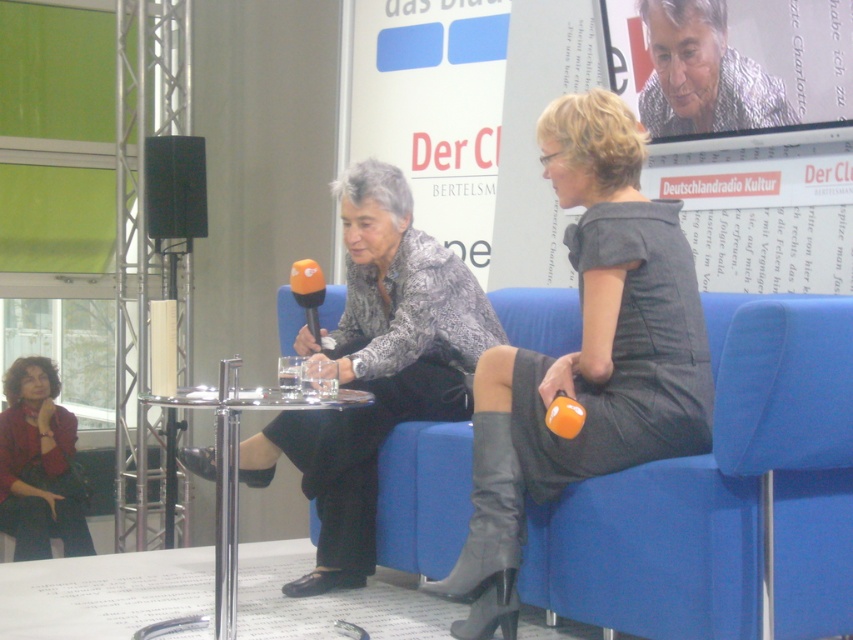
You are organizing a charity event and need to decide which of the two jackets to use as a prop. The textured gray sweater at center and the matte red jacket at lower left are available. Based on their sizes, which one would be more suitable for a prop that requires a larger size?

The matte red jacket at lower left is larger than the textured gray sweater at center, so it would be more suitable for a prop requiring a larger size.

You are organizing a photo shoot and need to position a spotlight above the textured gray sweater at center. Can you place it there without it overlapping the matte red jacket at lower left?

The textured gray sweater at center is located above the matte red jacket at lower left, so placing a spotlight above the textured gray sweater at center would not overlap the matte red jacket at lower left.

You are a photographer standing at the point marked by the coordinate point at (10, 413). You want to capture a photo of both individuals seated on the blue sofa so that they are both clearly visible in the frame. Given that your camera has a maximum focal length that allows capturing subjects within a 5.5 meter range, will you be able to include both individuals in the photo?

The two individuals are 5.33 meters apart. Since the maximum focal length allows capturing subjects within 5.5 meters, the distance between them is within the camera range. Therefore, both individuals can be included in the photo.